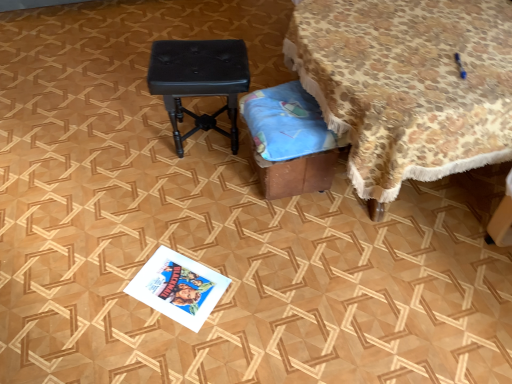
At what (x,y) coordinates should I click in order to perform the action: click on free area in between brown cardboard box at lower center and white glossy magazine at lower center. Please return your answer as a coordinate pair (x, y). The height and width of the screenshot is (384, 512). Looking at the image, I should click on (241, 231).